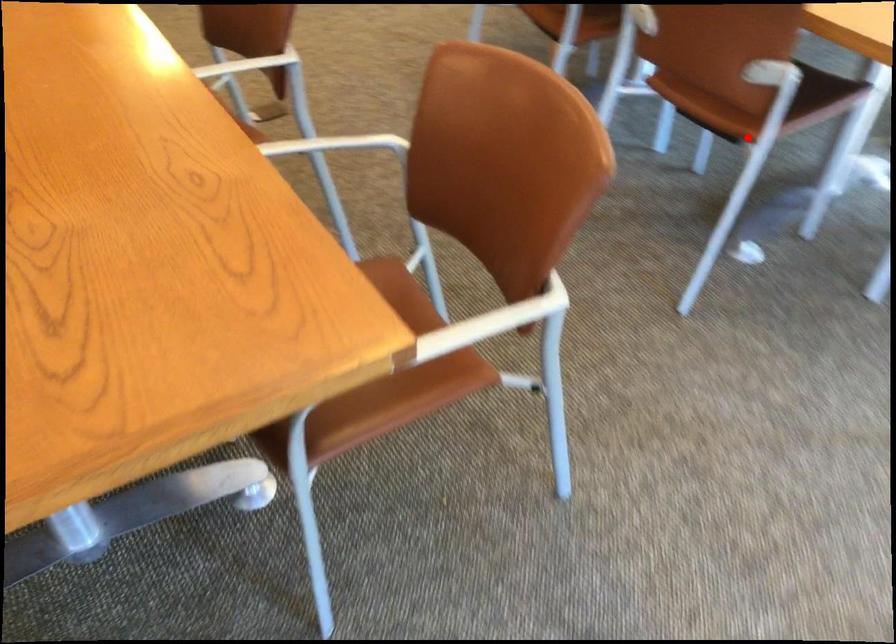
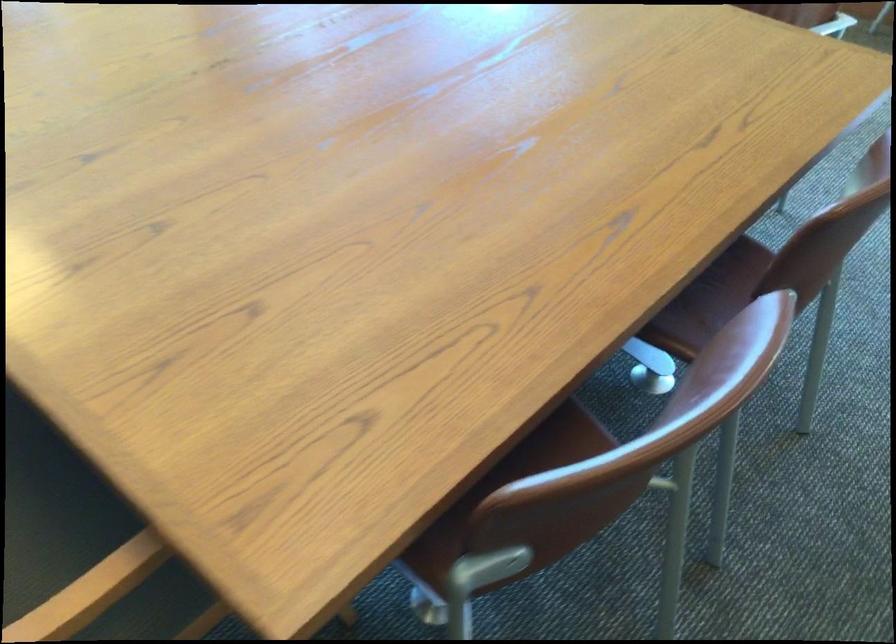
The point at the highlighted location is marked in the first image. Where is the corresponding point in the second image?

(711, 299)